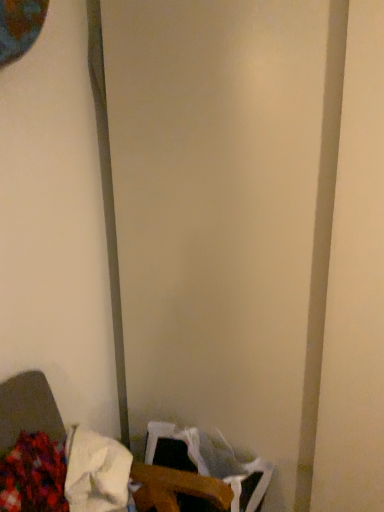
Measure the distance between white fabric at lower left, the 1th waste in the right-to-left sequence, and camera.

1.08 meters.

Locate an element on the screen. The width and height of the screenshot is (384, 512). fluffy fabric at lower left, which appears as the second waste when viewed from the right is located at coordinates (33, 475).

The width and height of the screenshot is (384, 512). Identify the location of white fabric at lower left, the 1th waste in the right-to-left sequence. 96,472.

Locate an element on the screen. Image resolution: width=384 pixels, height=512 pixels. waste that is the 1st object located above the wooden table at lower left (from the image's perspective) is located at coordinates (33, 475).

Is fluffy fabric at lower left, which is counted as the 1th waste, starting from the left, oriented away from wooden table at lower left?

A: Yes, wooden table at lower left is at the back of fluffy fabric at lower left, which is counted as the 1th waste, starting from the left.

Does point (57, 509) appear closer or farther from the camera than point (97, 449)?

Point (57, 509).

From a real-world perspective, is fluffy fabric at lower left, which appears as the second waste when viewed from the right, located beneath wooden table at lower left?

Incorrect, from a real-world perspective, fluffy fabric at lower left, which appears as the second waste when viewed from the right, is higher than wooden table at lower left.

Locate an element on the screen. The width and height of the screenshot is (384, 512). furniture that is below the white fabric at lower left, marked as the second waste in a left-to-right arrangement (from the image's perspective) is located at coordinates (92, 477).

How many degrees apart are the facing directions of white fabric at lower left, the 1th waste in the right-to-left sequence, and wooden table at lower left?

48.2 degrees separate the facing orientations of white fabric at lower left, the 1th waste in the right-to-left sequence, and wooden table at lower left.

Does point (83, 440) come in front of point (21, 473)?

No, it is not.

From a real-world perspective, is white fabric at lower left, marked as the second waste in a left-to-right arrangement, physically located above or below wooden table at lower left?

white fabric at lower left, marked as the second waste in a left-to-right arrangement, is above wooden table at lower left.

Are fluffy fabric at lower left, which is counted as the 1th waste, starting from the left, and white fabric at lower left, marked as the second waste in a left-to-right arrangement, making contact?

Indeed, fluffy fabric at lower left, which is counted as the 1th waste, starting from the left, and white fabric at lower left, marked as the second waste in a left-to-right arrangement, are beside each other and touching.

Which of these two, fluffy fabric at lower left, which is counted as the 1th waste, starting from the left, or white fabric at lower left, marked as the second waste in a left-to-right arrangement, is bigger?

fluffy fabric at lower left, which is counted as the 1th waste, starting from the left.

Is fluffy fabric at lower left, which appears as the second waste when viewed from the right, outside of white fabric at lower left, marked as the second waste in a left-to-right arrangement?

Indeed, fluffy fabric at lower left, which appears as the second waste when viewed from the right, is completely outside white fabric at lower left, marked as the second waste in a left-to-right arrangement.

Between fluffy fabric at lower left, which is counted as the 1th waste, starting from the left, and white fabric at lower left, the 1th waste in the right-to-left sequence, which one has smaller width?

fluffy fabric at lower left, which is counted as the 1th waste, starting from the left, is thinner.

Can you confirm if wooden table at lower left is shorter than fluffy fabric at lower left, which appears as the second waste when viewed from the right?

A: No, wooden table at lower left is not shorter than fluffy fabric at lower left, which appears as the second waste when viewed from the right.

Does point (216, 501) appear closer or farther from the camera than point (67, 502)?

Point (216, 501) is positioned closer to the camera compared to point (67, 502).

From the image's perspective, between wooden table at lower left and fluffy fabric at lower left, which appears as the second waste when viewed from the right, who is located below?

wooden table at lower left appears lower in the image.

Which of these two, wooden table at lower left or fluffy fabric at lower left, which is counted as the 1th waste, starting from the left, is wider?

With larger width is wooden table at lower left.

Is wooden table at lower left taller or shorter than white fabric at lower left, marked as the second waste in a left-to-right arrangement?

wooden table at lower left is taller than white fabric at lower left, marked as the second waste in a left-to-right arrangement.

From the image's perspective, is wooden table at lower left above or below white fabric at lower left, the 1th waste in the right-to-left sequence?

Clearly, from the image's perspective, wooden table at lower left is below white fabric at lower left, the 1th waste in the right-to-left sequence.

Which object is further away from the camera, wooden table at lower left or white fabric at lower left, marked as the second waste in a left-to-right arrangement?

white fabric at lower left, marked as the second waste in a left-to-right arrangement, is behind.

Does wooden table at lower left turn towards white fabric at lower left, the 1th waste in the right-to-left sequence?

No.

Considering the relative sizes of white fabric at lower left, marked as the second waste in a left-to-right arrangement, and fluffy fabric at lower left, which appears as the second waste when viewed from the right, in the image provided, is white fabric at lower left, marked as the second waste in a left-to-right arrangement, taller than fluffy fabric at lower left, which appears as the second waste when viewed from the right,?

No, white fabric at lower left, marked as the second waste in a left-to-right arrangement, is not taller than fluffy fabric at lower left, which appears as the second waste when viewed from the right.

From a real-world perspective, is white fabric at lower left, marked as the second waste in a left-to-right arrangement, on fluffy fabric at lower left, which appears as the second waste when viewed from the right?

Yes, from a real-world perspective, white fabric at lower left, marked as the second waste in a left-to-right arrangement, is above fluffy fabric at lower left, which appears as the second waste when viewed from the right.

What's the angular difference between white fabric at lower left, the 1th waste in the right-to-left sequence, and fluffy fabric at lower left, which appears as the second waste when viewed from the right,'s facing directions?

52.3 degrees separate the facing orientations of white fabric at lower left, the 1th waste in the right-to-left sequence, and fluffy fabric at lower left, which appears as the second waste when viewed from the right.

From the image's perspective, between white fabric at lower left, the 1th waste in the right-to-left sequence, and fluffy fabric at lower left, which appears as the second waste when viewed from the right, who is located below?

fluffy fabric at lower left, which appears as the second waste when viewed from the right.

From a real-world perspective, count 1st wastes upward from the wooden table at lower left and point to it. Please provide its 2D coordinates.

[(33, 475)]

From the wooden table at lower left, count 2nd wastes backward and point to it. Please provide its 2D coordinates.

[(96, 472)]

From the image, which object appears to be farther from wooden table at lower left, white fabric at lower left, marked as the second waste in a left-to-right arrangement, or fluffy fabric at lower left, which appears as the second waste when viewed from the right?

Based on the image, fluffy fabric at lower left, which appears as the second waste when viewed from the right, appears to be further to wooden table at lower left.

Based on their spatial positions, is white fabric at lower left, the 1th waste in the right-to-left sequence, or wooden table at lower left further from fluffy fabric at lower left, which appears as the second waste when viewed from the right?

white fabric at lower left, the 1th waste in the right-to-left sequence, is positioned further to the anchor fluffy fabric at lower left, which appears as the second waste when viewed from the right.

From the image, which object appears to be nearer to wooden table at lower left, fluffy fabric at lower left, which appears as the second waste when viewed from the right, or white fabric at lower left, the 1th waste in the right-to-left sequence?

white fabric at lower left, the 1th waste in the right-to-left sequence, lies closer to wooden table at lower left than the other object.

Which object lies nearer to the anchor point white fabric at lower left, marked as the second waste in a left-to-right arrangement, wooden table at lower left or fluffy fabric at lower left, which is counted as the 1th waste, starting from the left?

wooden table at lower left is positioned closer to the anchor white fabric at lower left, marked as the second waste in a left-to-right arrangement.

Consider the image. Which object lies further to the anchor point fluffy fabric at lower left, which is counted as the 1th waste, starting from the left, wooden table at lower left or white fabric at lower left, marked as the second waste in a left-to-right arrangement?

white fabric at lower left, marked as the second waste in a left-to-right arrangement, is further to fluffy fabric at lower left, which is counted as the 1th waste, starting from the left.

Based on their spatial positions, is fluffy fabric at lower left, which is counted as the 1th waste, starting from the left, or wooden table at lower left further from white fabric at lower left, marked as the second waste in a left-to-right arrangement?

Based on the image, fluffy fabric at lower left, which is counted as the 1th waste, starting from the left, appears to be further to white fabric at lower left, marked as the second waste in a left-to-right arrangement.

The width and height of the screenshot is (384, 512). In order to click on waste between wooden table at lower left and white fabric at lower left, the 1th waste in the right-to-left sequence, along the z-axis in this screenshot , I will do `click(33, 475)`.